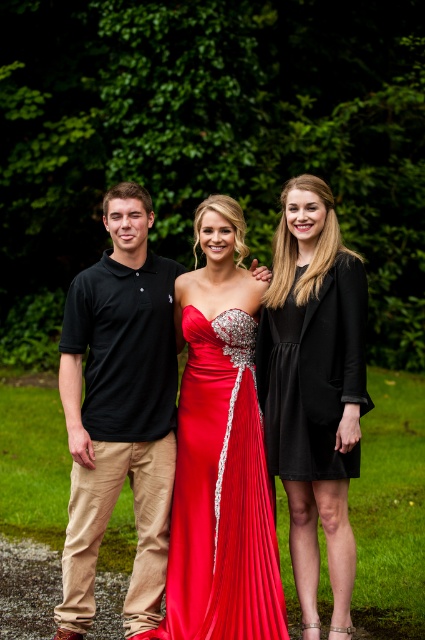
Does point (121, 216) come closer to viewer compared to point (272, 444)?

No, (121, 216) is behind (272, 444).

This screenshot has width=425, height=640. What do you see at coordinates (119, 412) in the screenshot?
I see `black cotton polo shirt at left` at bounding box center [119, 412].

The height and width of the screenshot is (640, 425). What are the coordinates of `black cotton polo shirt at left` in the screenshot? It's located at (119, 412).

Is black cotton polo shirt at left thinner than black matte dress at right?

No.

Is black cotton polo shirt at left above black matte dress at right?

No, black cotton polo shirt at left is not above black matte dress at right.

Between point (93, 541) and point (300, 440), which one is positioned behind?

The point (93, 541) is behind.

Where is `black cotton polo shirt at left`? black cotton polo shirt at left is located at coordinates (119, 412).

Who is positioned more to the left, shiny satin gown at center or black satin dress at right?

From the viewer's perspective, shiny satin gown at center appears more on the left side.

Between shiny satin gown at center and black satin dress at right, which one is positioned lower?

shiny satin gown at center is lower down.

Describe the element at coordinates (221, 493) in the screenshot. I see `shiny satin gown at center` at that location.

This screenshot has height=640, width=425. I want to click on shiny satin gown at center, so click(x=221, y=493).